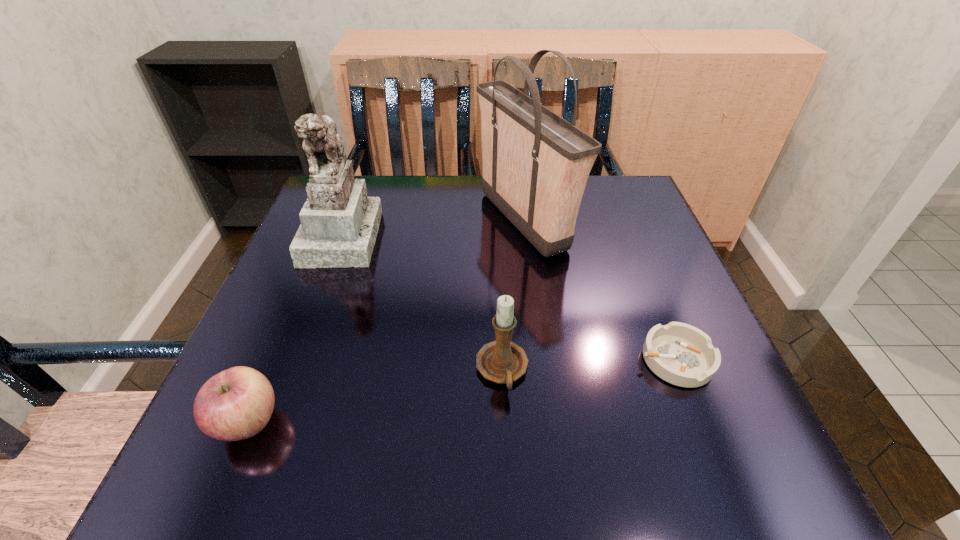
Identify the location of the tallest object. (536, 164).

In order to click on figurine in this screenshot , I will do `click(339, 224)`.

At what (x,y) coordinates should I click in order to perform the action: click on the third tallest object. Please return your answer as a coordinate pair (x, y). Image resolution: width=960 pixels, height=540 pixels. Looking at the image, I should click on (502, 361).

The image size is (960, 540). I want to click on apple, so click(x=237, y=403).

Where is `the shortest object`? The image size is (960, 540). the shortest object is located at coordinates (683, 355).

Locate an element on the screen. The width and height of the screenshot is (960, 540). ashtray is located at coordinates (683, 355).

The height and width of the screenshot is (540, 960). What are the coordinates of `vacant area located on the left of the tallest object` in the screenshot? It's located at (379, 221).

The image size is (960, 540). Find the location of `free space located on the front-facing side of the figurine`. free space located on the front-facing side of the figurine is located at coordinates (484, 236).

At what (x,y) coordinates should I click in order to perform the action: click on vacant region located 0.120m on the side of the third shortest object with the handle. Please return your answer as a coordinate pair (x, y). This screenshot has height=540, width=960. Looking at the image, I should click on (507, 477).

Where is `free spot located 0.060m on the back of the apple`? free spot located 0.060m on the back of the apple is located at coordinates (274, 362).